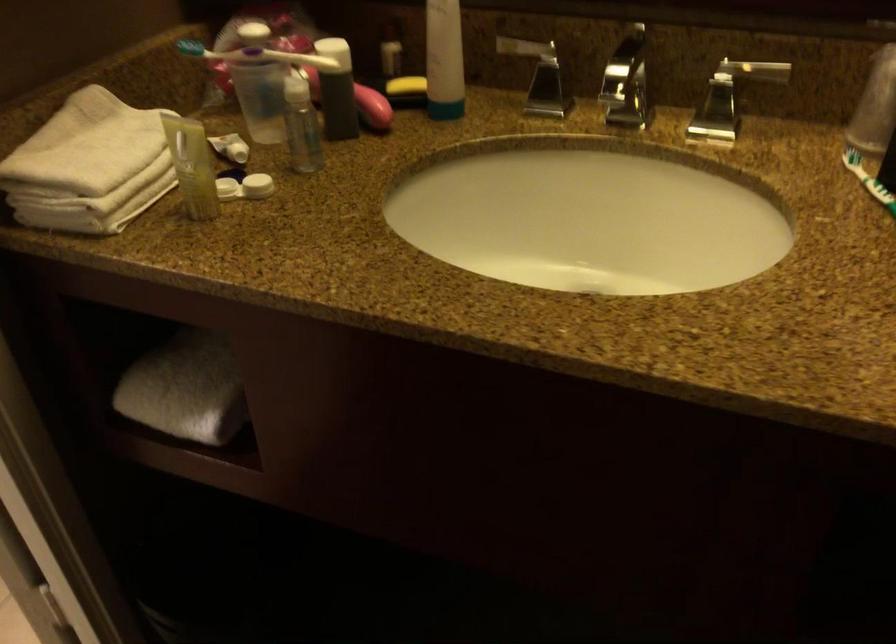
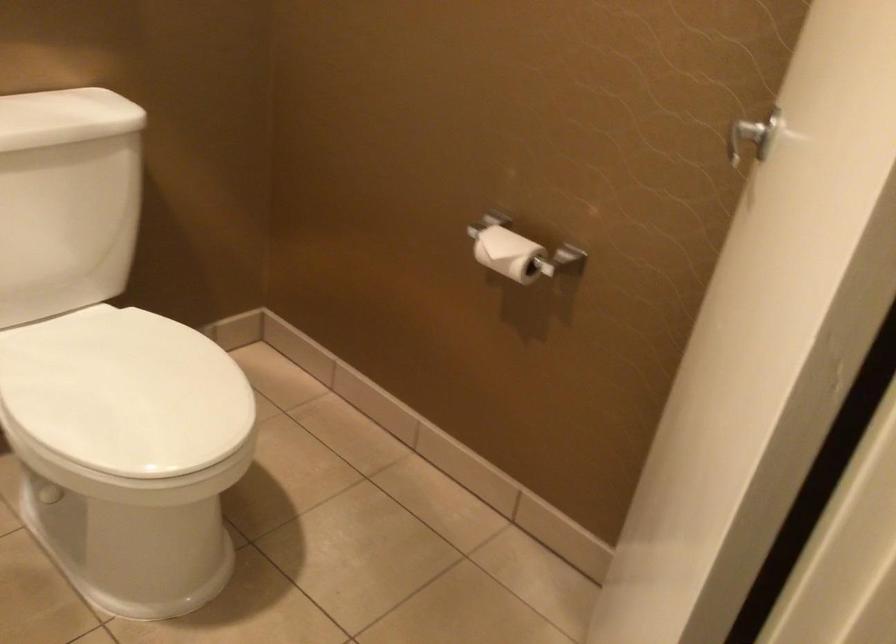
Question: How did the camera likely rotate?

Choices:
 (A) Left
 (B) Right
 (C) Up
 (D) Down

Answer: (A)